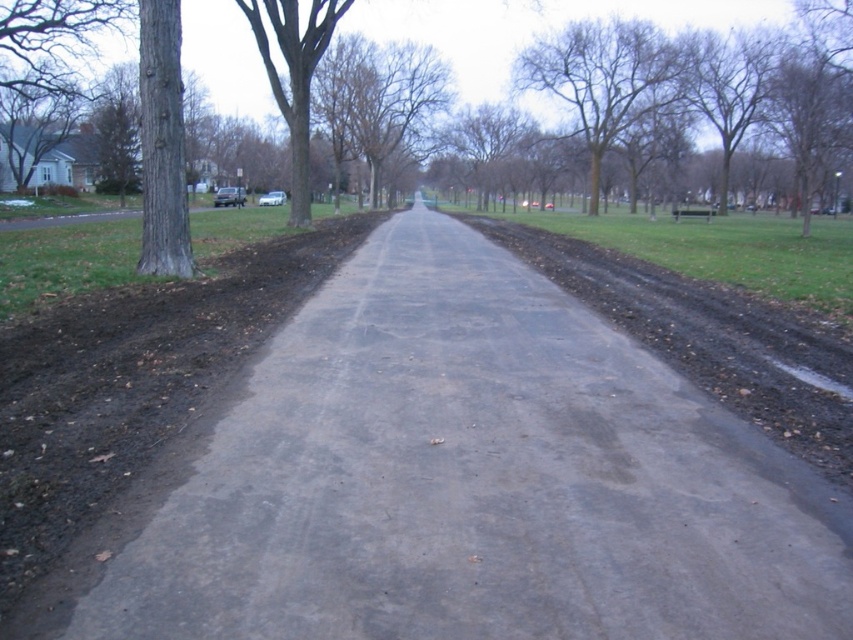
Can you confirm if gray asphalt path at center is positioned above brown rough tree at left?

Actually, gray asphalt path at center is below brown rough tree at left.

Who is higher up, gray asphalt path at center or brown rough tree at left?

brown rough tree at left is above.

Where is `gray asphalt path at center`? This screenshot has height=640, width=853. gray asphalt path at center is located at coordinates (393, 465).

Does point (506, 323) come closer to viewer compared to point (660, 29)?

Yes.

Does gray asphalt path at center come behind bare branches at upper center?

No.

Does point (444, 394) lie behind point (595, 125)?

No, (444, 394) is closer to viewer.

Identify the location of gray asphalt path at center. (393, 465).

Is the position of bare branches at upper center less distant than that of brown rough tree at left?

No, it is not.

Between bare branches at upper center and brown rough tree at left, which one appears on the right side from the viewer's perspective?

From the viewer's perspective, bare branches at upper center appears more on the right side.

Locate an element on the screen. bare branches at upper center is located at coordinates (601, 77).